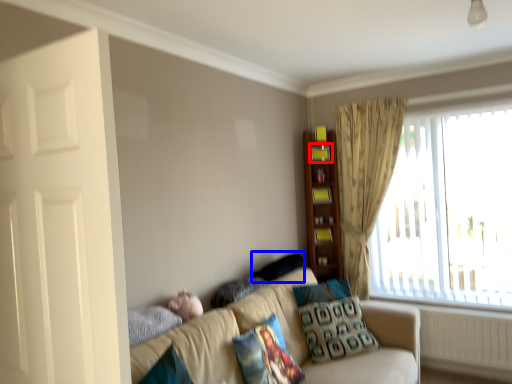
Question: Which object is further to the camera taking this photo, shelf (highlighted by a red box) or pillow (highlighted by a blue box)?

Choices:
 (A) shelf
 (B) pillow

Answer: (A)